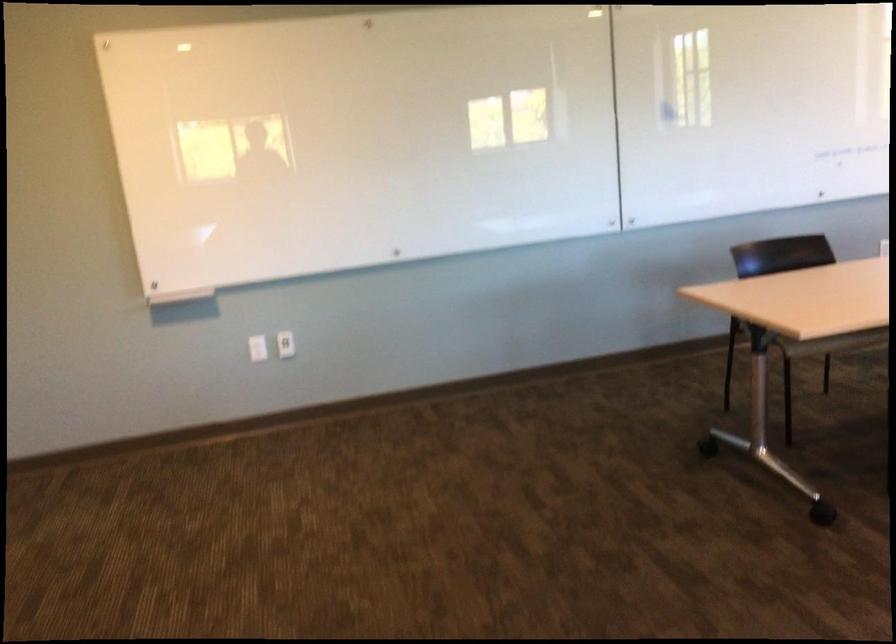
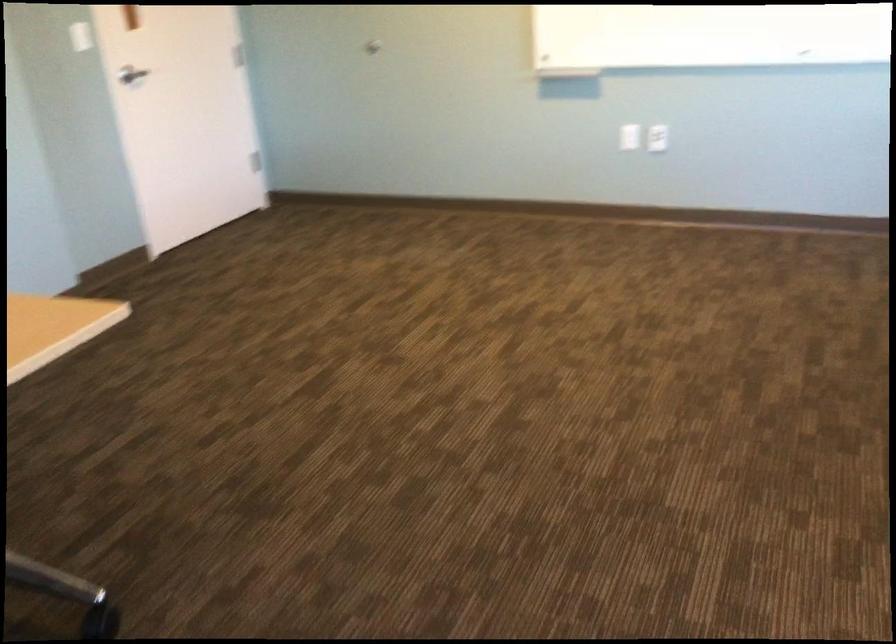
Locate, in the second image, the point that corresponds to point (261, 351) in the first image.

(629, 137)